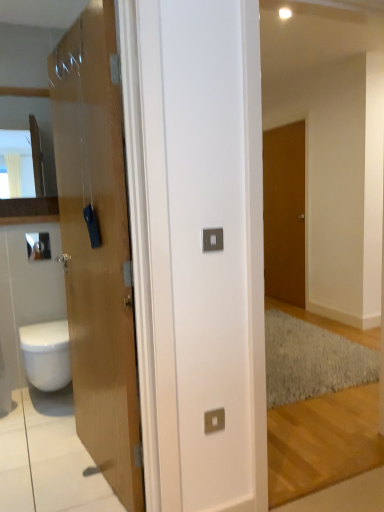
Question: Would you say matte wooden door at left, the first door when ordered from front to back, is part of matte wood cabinet at left's contents?

Choices:
 (A) yes
 (B) no

Answer: (B)

Question: Considering the relative sizes of matte wood cabinet at left and matte wooden door at left, the first door when ordered from front to back, in the image provided, is matte wood cabinet at left smaller than matte wooden door at left, the first door when ordered from front to back,?

Choices:
 (A) yes
 (B) no

Answer: (A)

Question: Can you confirm if matte wood cabinet at left is wider than matte wooden door at left, which is the 1th door in left-to-right order?

Choices:
 (A) no
 (B) yes

Answer: (A)

Question: From a real-world perspective, is matte wood cabinet at left positioned under matte wooden door at left, placed as the second door when sorted from back to front, based on gravity?

Choices:
 (A) yes
 (B) no

Answer: (B)

Question: Is matte wood cabinet at left looking in the opposite direction of matte wooden door at left, which is the 1th door in left-to-right order?

Choices:
 (A) no
 (B) yes

Answer: (A)

Question: Would you say matte wood cabinet at left is outside matte wooden door at left, the first door when ordered from front to back?

Choices:
 (A) yes
 (B) no

Answer: (A)

Question: From a real-world perspective, is metallic square at center, the second electric outlet from the front, physically below matte wooden door at left, the first door when ordered from front to back?

Choices:
 (A) yes
 (B) no

Answer: (A)

Question: Does metallic square at center, the 2th electric outlet in the top-to-bottom sequence, appear on the right side of matte wooden door at left, which is the 1th door in left-to-right order?

Choices:
 (A) no
 (B) yes

Answer: (B)

Question: Does metallic square at center, which is the first electric outlet in back-to-front order, have a greater width compared to matte wooden door at left, placed as the second door when sorted from back to front?

Choices:
 (A) no
 (B) yes

Answer: (A)

Question: Does metallic square at center, arranged as the first electric outlet when ordered from the bottom, touch matte wooden door at left, placed as the second door when sorted from back to front?

Choices:
 (A) no
 (B) yes

Answer: (A)

Question: Is metallic square at center, the second electric outlet from the front, to the left of matte wooden door at left, the first door when ordered from front to back, from the viewer's perspective?

Choices:
 (A) no
 (B) yes

Answer: (A)

Question: From a real-world perspective, is metallic square at center, the second electric outlet from the front, over matte wooden door at left, which is the 1th door in left-to-right order?

Choices:
 (A) yes
 (B) no

Answer: (B)

Question: Is metallic square at center, the second electric outlet from the front, with matte wood cabinet at left?

Choices:
 (A) yes
 (B) no

Answer: (B)